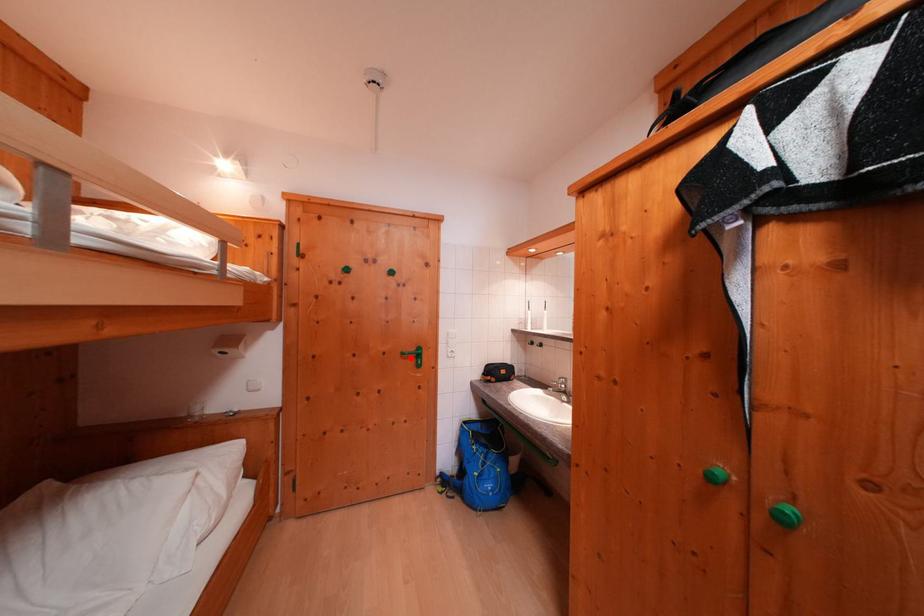
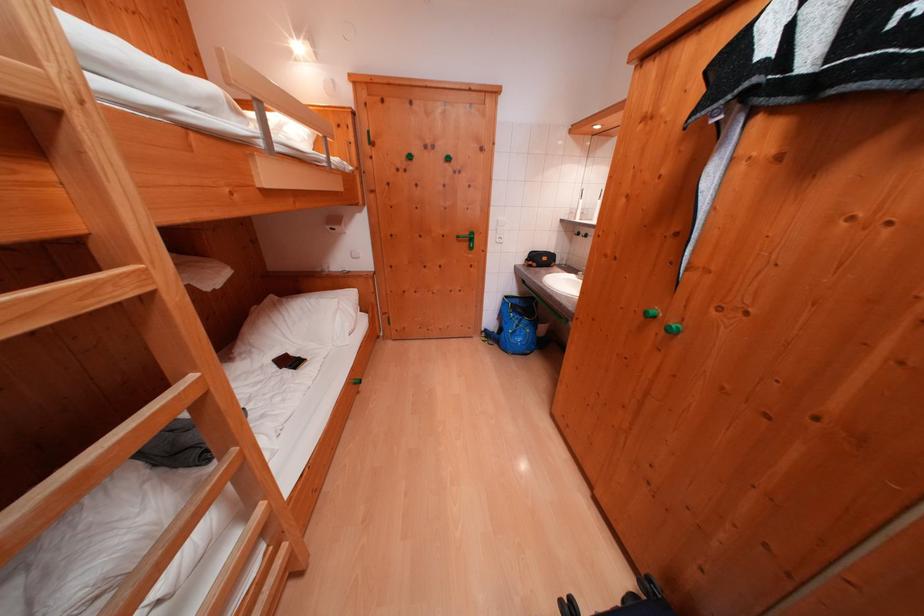
In the second image, find the point that corresponds to the highlighted location in the first image.

(466, 241)